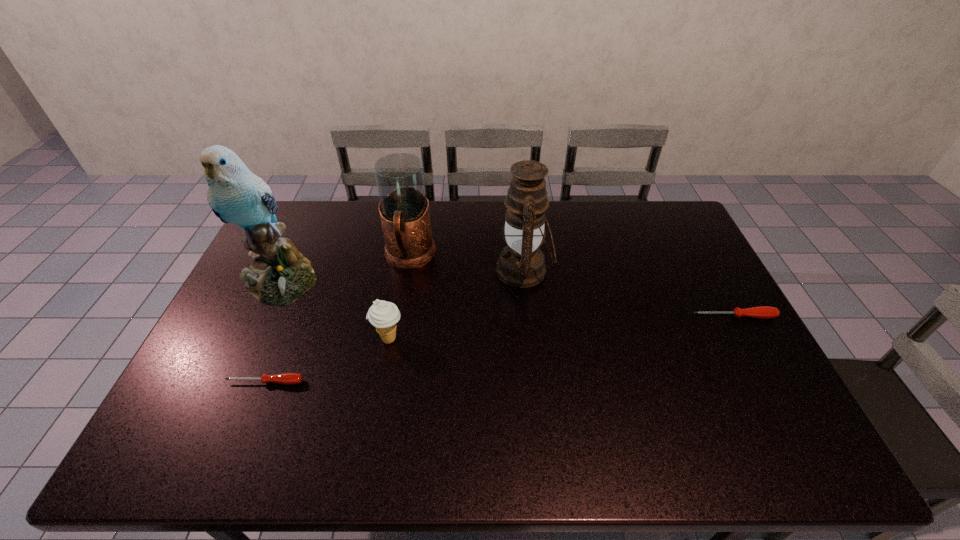
Find the location of a particular element. The width and height of the screenshot is (960, 540). vacant space located on the back of the third nearest object is located at coordinates (691, 240).

The height and width of the screenshot is (540, 960). Find the location of `free space located on the left of the fifth object from left to right`. free space located on the left of the fifth object from left to right is located at coordinates (405, 270).

Identify the location of vacant space located 0.130m with the handle on the side of the fourth shortest object. The height and width of the screenshot is (540, 960). (400, 312).

Image resolution: width=960 pixels, height=540 pixels. What are the coordinates of `free spot located on the face of the tallest object` in the screenshot? It's located at (241, 364).

The width and height of the screenshot is (960, 540). What are the coordinates of `vacant region located on the left of the third shortest object` in the screenshot? It's located at (246, 339).

This screenshot has width=960, height=540. What are the coordinates of `object situated at the far edge` in the screenshot? It's located at (404, 211).

This screenshot has height=540, width=960. I want to click on object at the near edge, so (x=285, y=378).

Image resolution: width=960 pixels, height=540 pixels. Identify the location of screwdriver at the left edge. (285, 378).

Locate an element on the screen. The image size is (960, 540). parakeet present at the left edge is located at coordinates (279, 275).

Find the location of a particular element. object that is at the right edge is located at coordinates (762, 312).